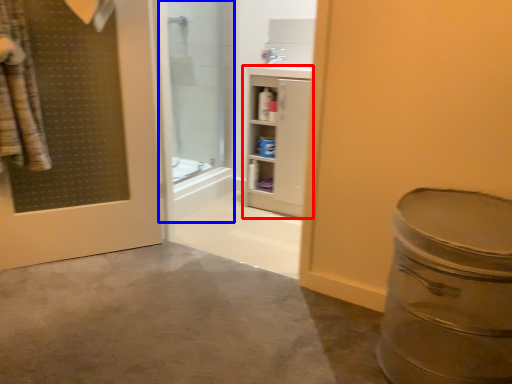
Question: Among these objects, which one is farthest to the camera, bathroom cabinet (highlighted by a red box) or shower door (highlighted by a blue box)?

Choices:
 (A) bathroom cabinet
 (B) shower door

Answer: (A)